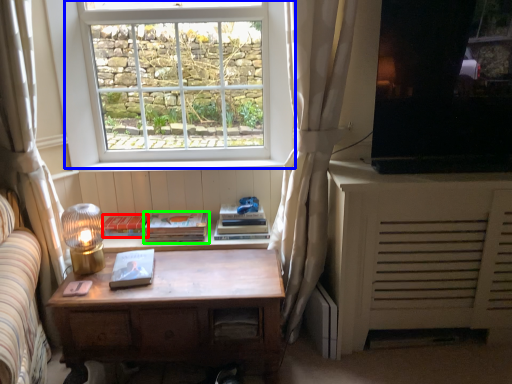
Question: Which object is the closest to the paperback book (highlighted by a red box)? Choose among these: window (highlighted by a blue box) or paperback book (highlighted by a green box).

Choices:
 (A) window
 (B) paperback book

Answer: (B)